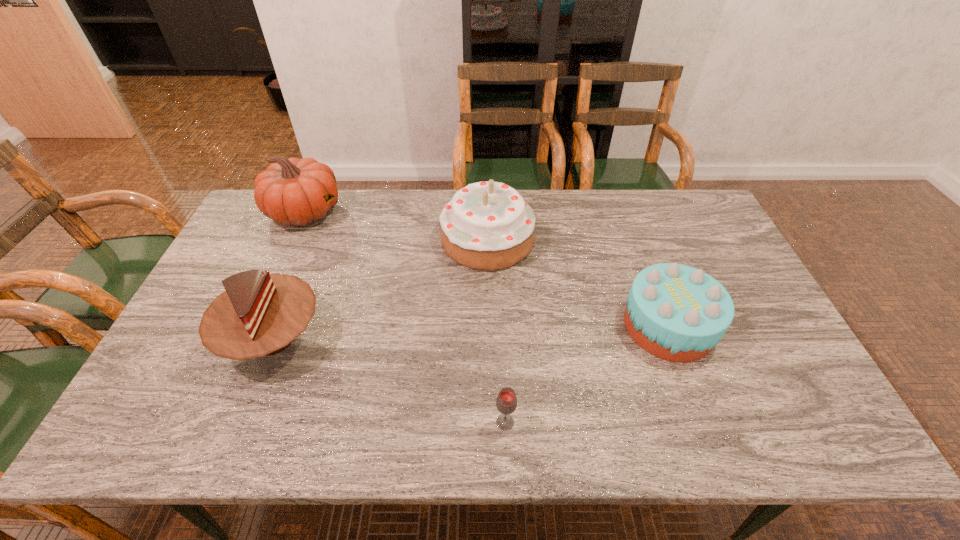
Where is `object that is the second closest to the glass drink container`? object that is the second closest to the glass drink container is located at coordinates (260, 314).

Point out which object is positioned as the third nearest to the pumpkin. Please provide its 2D coordinates. Your answer should be formatted as a tuple, i.e. [(x, y)], where the tuple contains the x and y coordinates of a point satisfying the conditions above.

[(506, 402)]

Identify which cake is the closest to the shortest object. Please provide its 2D coordinates. Your answer should be formatted as a tuple, i.e. [(x, y)], where the tuple contains the x and y coordinates of a point satisfying the conditions above.

[(675, 312)]

I want to click on the second closest cake to the leftmost cake, so click(x=675, y=312).

Where is `vacant region that satisfies the following two spatial constraints: 1. on the back side of the rightmost cake; 2. on the right side of the glass drink container`? vacant region that satisfies the following two spatial constraints: 1. on the back side of the rightmost cake; 2. on the right side of the glass drink container is located at coordinates (501, 326).

At what (x,y) coordinates should I click in order to perform the action: click on free location that satisfies the following two spatial constraints: 1. on the face of the pumpkin; 2. on the right side of the glass drink container. Please return your answer as a coordinate pair (x, y). The image size is (960, 540). Looking at the image, I should click on (210, 422).

Find the location of `free space that satisfies the following two spatial constraints: 1. on the face of the pumpkin; 2. on the left side of the second cake from left to right`. free space that satisfies the following two spatial constraints: 1. on the face of the pumpkin; 2. on the left side of the second cake from left to right is located at coordinates (293, 239).

The image size is (960, 540). In order to click on free space in the image that satisfies the following two spatial constraints: 1. on the face of the glass drink container; 2. on the left side of the pumpkin in this screenshot , I will do `click(210, 422)`.

The height and width of the screenshot is (540, 960). Identify the location of vacant point that satisfies the following two spatial constraints: 1. on the face of the rightmost cake; 2. on the right side of the pumpkin. tap(253, 326).

Identify the location of free space that satisfies the following two spatial constraints: 1. on the face of the pumpkin; 2. on the right side of the nearest object. This screenshot has height=540, width=960. (210, 422).